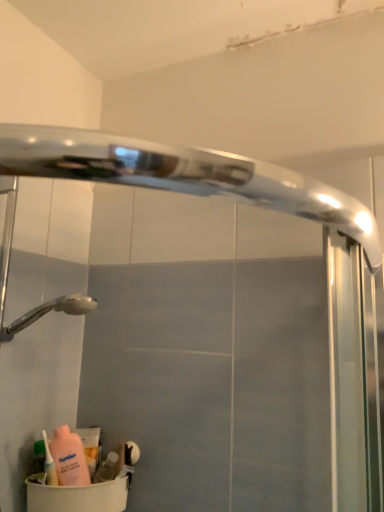
Question: Is pink matte bottle at lower left, arranged as the first cleaning product when viewed from the front, positioned before matte pink lotion at lower left, acting as the 2th cleaning product starting from the front?

Choices:
 (A) no
 (B) yes

Answer: (B)

Question: Is matte pink lotion at lower left, which is the second cleaning product in left-to-right order, a part of pink matte bottle at lower left, placed as the 2th cleaning product when sorted from right to left?

Choices:
 (A) no
 (B) yes

Answer: (A)

Question: Can you confirm if pink matte bottle at lower left, which is counted as the first cleaning product, starting from the left, is positioned to the left of matte pink lotion at lower left, which is the second cleaning product in left-to-right order?

Choices:
 (A) yes
 (B) no

Answer: (A)

Question: From the image's perspective, is pink matte bottle at lower left, which is counted as the first cleaning product, starting from the left, over matte pink lotion at lower left, which is the second cleaning product in left-to-right order?

Choices:
 (A) yes
 (B) no

Answer: (A)

Question: From a real-world perspective, is pink matte bottle at lower left, arranged as the first cleaning product when viewed from the front, on matte pink lotion at lower left, acting as the 2th cleaning product starting from the front?

Choices:
 (A) yes
 (B) no

Answer: (A)

Question: From a real-world perspective, is matte pink lotion at lower left, positioned as the 1th cleaning product in back-to-front order, above or below translucent plastic soap at lower left, placed as the 1th toiletry when sorted from right to left?

Choices:
 (A) below
 (B) above

Answer: (B)

Question: Would you say matte pink lotion at lower left, which is the second cleaning product in left-to-right order, is inside or outside translucent plastic soap at lower left, acting as the 2th toiletry starting from the left?

Choices:
 (A) outside
 (B) inside

Answer: (A)

Question: From the image's perspective, is matte pink lotion at lower left, acting as the 2th cleaning product starting from the front, positioned above or below translucent plastic soap at lower left, placed as the 1th toiletry when sorted from right to left?

Choices:
 (A) below
 (B) above

Answer: (B)

Question: Considering the positions of matte pink lotion at lower left, positioned as the 1th cleaning product in back-to-front order, and translucent plastic soap at lower left, placed as the 1th toiletry when sorted from right to left, in the image, is matte pink lotion at lower left, positioned as the 1th cleaning product in back-to-front order, taller or shorter than translucent plastic soap at lower left, placed as the 1th toiletry when sorted from right to left,?

Choices:
 (A) tall
 (B) short

Answer: (A)

Question: Considering the positions of point (43, 465) and point (114, 456), is point (43, 465) closer or farther from the camera than point (114, 456)?

Choices:
 (A) farther
 (B) closer

Answer: (B)

Question: Based on their positions, is green matte bottle at lower left, the first toiletry in the left-to-right sequence, located to the left or right of translucent plastic soap at lower left, placed as the 1th toiletry when sorted from right to left?

Choices:
 (A) left
 (B) right

Answer: (A)

Question: In terms of width, does green matte bottle at lower left, the first toiletry in the left-to-right sequence, look wider or thinner when compared to translucent plastic soap at lower left, acting as the 2th toiletry starting from the left?

Choices:
 (A) wide
 (B) thin

Answer: (B)

Question: From their relative heights in the image, would you say green matte bottle at lower left, which appears as the second toiletry when viewed from the right, is taller or shorter than translucent plastic soap at lower left, placed as the 1th toiletry when sorted from right to left?

Choices:
 (A) tall
 (B) short

Answer: (A)

Question: Would you say beige plastic container at lower left is inside or outside matte pink lotion at lower left, acting as the 2th cleaning product starting from the front?

Choices:
 (A) inside
 (B) outside

Answer: (B)

Question: Looking at the image, does beige plastic container at lower left seem bigger or smaller compared to matte pink lotion at lower left, acting as the 2th cleaning product starting from the front?

Choices:
 (A) big
 (B) small

Answer: (A)